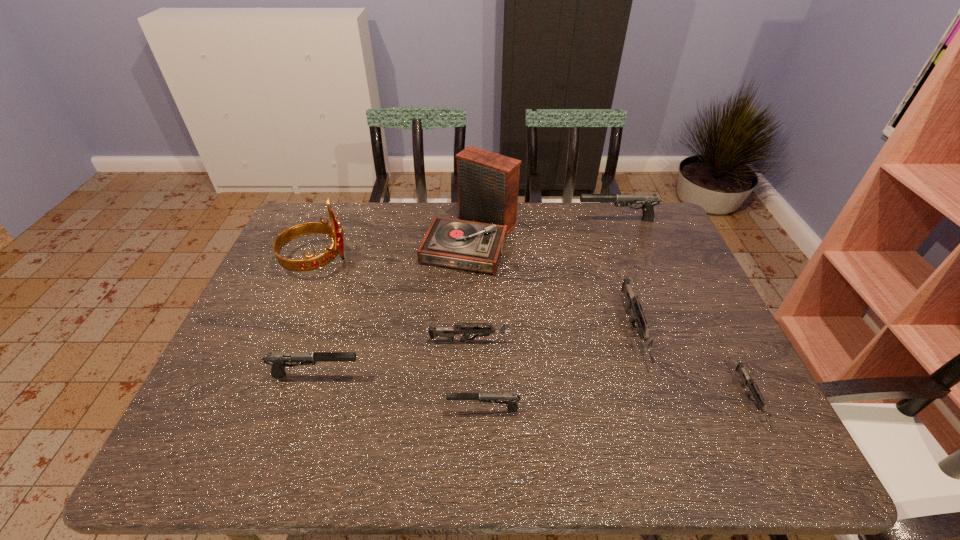
Find the location of a particular element. Image resolution: width=960 pixels, height=540 pixels. vacant space that's between the second grey gun from left to right and the leftmost gun is located at coordinates (474, 353).

Locate an element on the screen. This screenshot has height=540, width=960. vacant region between the leftmost grey gun and the farthest gun is located at coordinates (544, 281).

At what (x,y) coordinates should I click in order to perform the action: click on free space between the tiara and the phonograph record. Please return your answer as a coordinate pair (x, y). Looking at the image, I should click on tap(396, 249).

This screenshot has height=540, width=960. Find the location of `free spot between the biggest gray gun and the second nearest gray gun`. free spot between the biggest gray gun and the second nearest gray gun is located at coordinates (466, 298).

Identify the location of unoccupied position between the leftmost grey gun and the second gray gun from left to right. (479, 375).

Locate an element on the screen. free space between the tallest gun and the smallest gray gun is located at coordinates (551, 315).

Identify the location of free space between the leftmost grey gun and the shortest object. This screenshot has width=960, height=540. (612, 372).

Locate an element on the screen. vacant space that's between the rightmost object and the red tiara is located at coordinates (533, 330).

This screenshot has height=540, width=960. Identify the location of vacant point located between the nearest gray gun and the rightmost object. (617, 406).

The height and width of the screenshot is (540, 960). Identify the location of object that can be found as the seventh closest to the shortest gun. (334, 231).